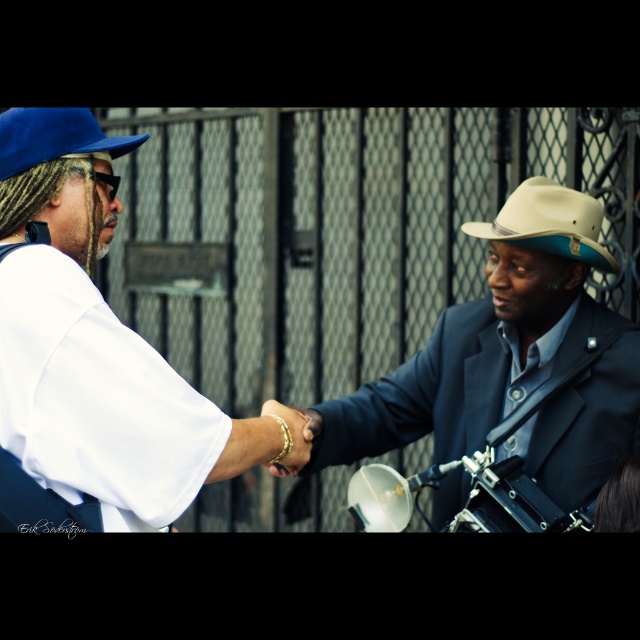
Between white matte shirt at left and matte black suit at center, which one has more height?

matte black suit at center is taller.

Is white matte shirt at left in front of matte black suit at center?

Yes, it is.

What do you see at coordinates (92, 352) in the screenshot? The width and height of the screenshot is (640, 640). I see `white matte shirt at left` at bounding box center [92, 352].

You are a GUI agent. You are given a task and a screenshot of the screen. Output one action in this format:
    pyautogui.click(x=<x>, y=<y>)
    Task: Click on the white matte shirt at left
    This screenshot has width=640, height=640.
    Given the screenshot: What is the action you would take?
    pyautogui.click(x=92, y=352)

Identify the location of white matte shirt at left. (92, 352).

What do you see at coordinates (92, 352) in the screenshot? I see `white matte shirt at left` at bounding box center [92, 352].

Which is in front, point (51, 477) or point (58, 147)?

Point (51, 477) is more forward.

You are a GUI agent. You are given a task and a screenshot of the screen. Output one action in this format:
    pyautogui.click(x=<x>, y=<y>)
    Task: Click on the white matte shirt at left
    The height and width of the screenshot is (640, 640).
    Given the screenshot: What is the action you would take?
    pyautogui.click(x=92, y=352)

Does matte black suit at center come behind beige felt fedora at right?

No, matte black suit at center is closer to the viewer.

Is matte black suit at center shorter than beige felt fedora at right?

In fact, matte black suit at center may be taller than beige felt fedora at right.

Who is more forward, (500, 371) or (529, 180)?

Point (500, 371) is more forward.

I want to click on matte black suit at center, so click(484, 336).